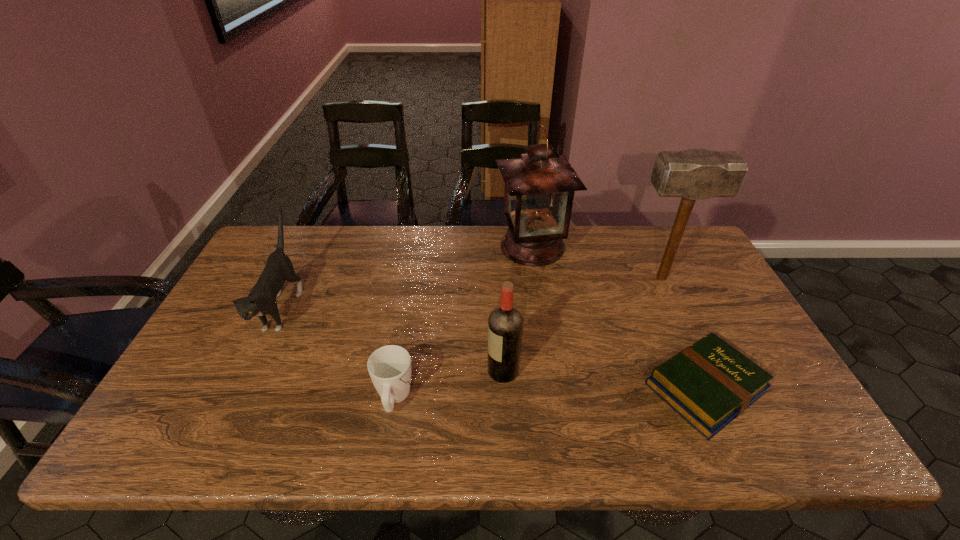
Locate an element on the screen. This screenshot has width=960, height=540. free space located on the striking face of the mallet is located at coordinates (510, 278).

Find the location of `free space located 0.050m on the striking face of the mallet`. free space located 0.050m on the striking face of the mallet is located at coordinates (612, 278).

Find the location of a particular element. The height and width of the screenshot is (540, 960). free location located on the front-facing side of the third tallest object is located at coordinates (440, 371).

This screenshot has width=960, height=540. Find the location of `free point located 0.190m on the front-facing side of the third tallest object`. free point located 0.190m on the front-facing side of the third tallest object is located at coordinates (411, 371).

Identify the location of free space located 0.120m on the front-facing side of the third tallest object. (440, 371).

This screenshot has width=960, height=540. I want to click on vacant space located at the face of the third shortest object, so (x=233, y=411).

You are a GUI agent. You are given a task and a screenshot of the screen. Output one action in this format:
    pyautogui.click(x=<x>, y=<y>)
    Task: Click on the vacant space located 0.110m on the side of the second object from left to right with the handle
    Image resolution: width=960 pixels, height=540 pixels.
    Given the screenshot: What is the action you would take?
    pyautogui.click(x=403, y=341)

At what (x,y) coordinates should I click in order to perform the action: click on vacant space located 0.050m on the side of the second object from left to right with the handle. Please return your answer as a coordinate pair (x, y). This screenshot has height=540, width=960. Looking at the image, I should click on (400, 359).

I want to click on vacant space located 0.330m on the side of the second object from left to right with the handle, so click(413, 286).

Image resolution: width=960 pixels, height=540 pixels. In order to click on free spot located 0.220m on the left of the book in this screenshot , I will do `click(555, 388)`.